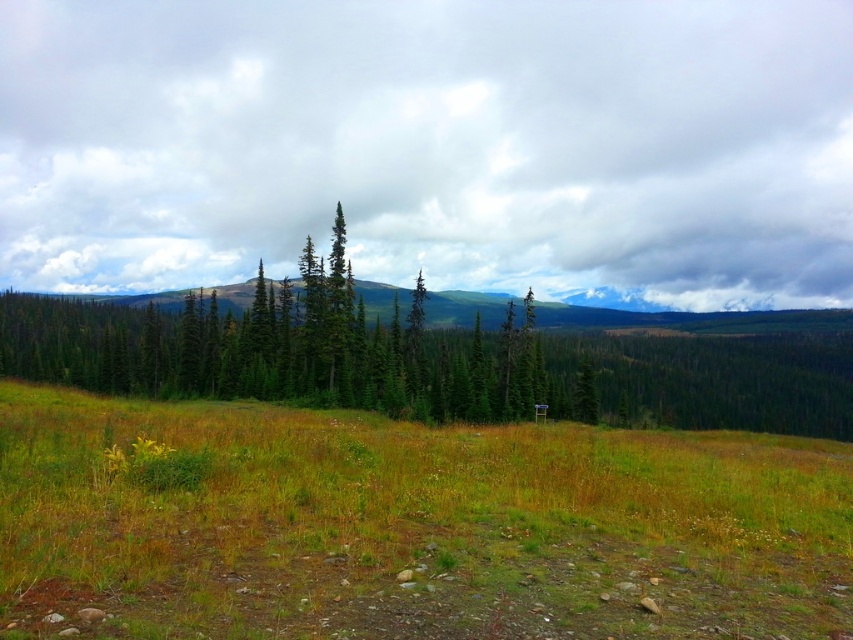
Question: Among these points, which one is nearest to the camera?

Choices:
 (A) pos(244,490)
 (B) pos(341,257)

Answer: (A)

Question: Is green grassy field at lower center to the right of green matte tree at center from the viewer's perspective?

Choices:
 (A) no
 (B) yes

Answer: (B)

Question: Does green grassy field at lower center lie in front of green matte tree at center?

Choices:
 (A) yes
 (B) no

Answer: (A)

Question: Can you confirm if green grassy field at lower center is thinner than green matte tree at center?

Choices:
 (A) no
 (B) yes

Answer: (A)